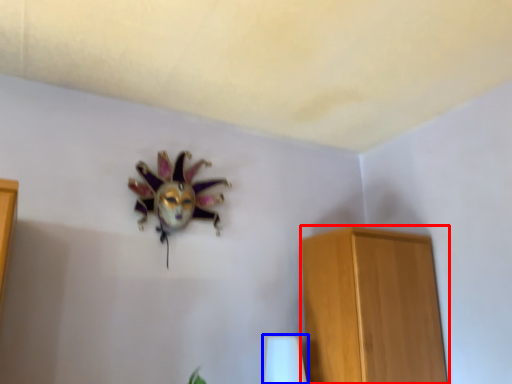
Question: Which object appears farthest to the camera in this image, furniture (highlighted by a red box) or table lamp (highlighted by a blue box)?

Choices:
 (A) furniture
 (B) table lamp

Answer: (B)